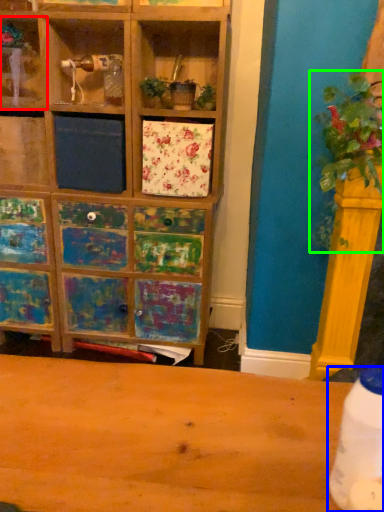
Question: Which object is positioned closest to shelf (highlighted by a red box)? Select from bottle (highlighted by a blue box) and floral arrangement (highlighted by a green box).

Choices:
 (A) bottle
 (B) floral arrangement

Answer: (B)